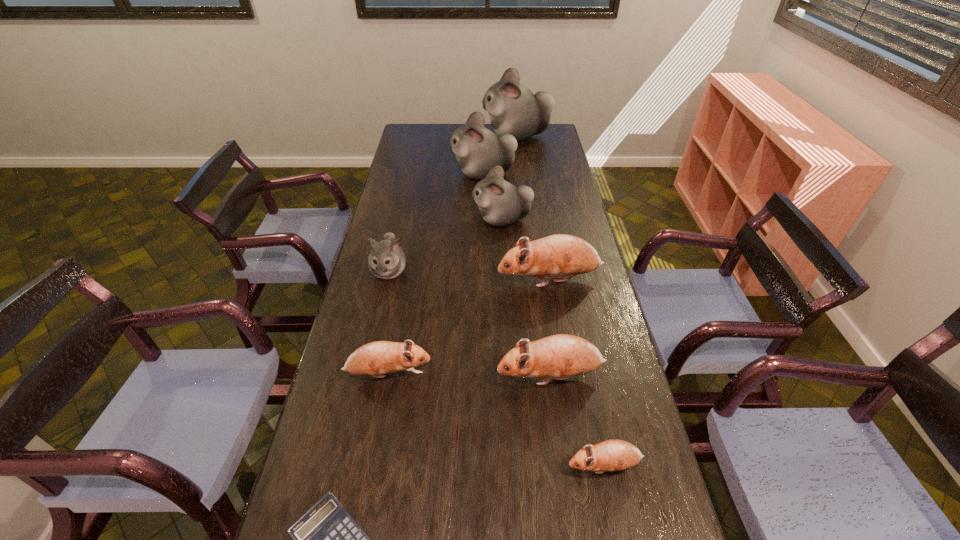
You are a GUI agent. You are given a task and a screenshot of the screen. Output one action in this format:
    pyautogui.click(x=<x>, y=<y>)
    Task: Click on the hamster identified as the sixth closest to the third smallest brown hamster
    
    Given the screenshot: What is the action you would take?
    point(478,149)

At what (x,y) coordinates should I click in order to perform the action: click on hamster that is the fifth closest one to the nearest object. Please return your answer as a coordinate pair (x, y). The image size is (960, 540). Looking at the image, I should click on (557, 255).

Image resolution: width=960 pixels, height=540 pixels. What are the coordinates of `white hamster that can be found as the third closest to the smallest white hamster` in the screenshot? It's located at (513, 109).

Identify the location of white hamster that is the closest one to the tallest object. (478, 149).

The image size is (960, 540). I want to click on brown hamster object that ranks as the third closest to the smallest white hamster, so click(x=562, y=356).

The height and width of the screenshot is (540, 960). I want to click on the third closest brown hamster to the shortest object, so click(x=611, y=455).

In order to click on blank area in the image that satisfies the following two spatial constraints: 1. on the face of the eighth shortest object; 2. on the face of the smallest white hamster in this screenshot , I will do `click(484, 271)`.